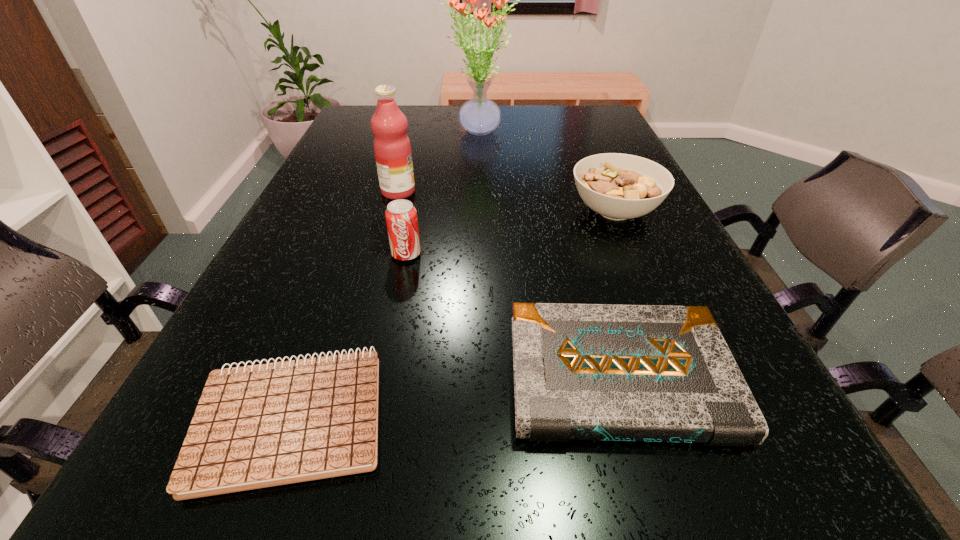
Where is `free space that is in between the fifth tallest object and the shortest object`? free space that is in between the fifth tallest object and the shortest object is located at coordinates (455, 397).

You are a GUI agent. You are given a task and a screenshot of the screen. Output one action in this format:
    pyautogui.click(x=<x>, y=<y>)
    Task: Click on the vacant space in between the farthest object and the fourth farthest object
    The height and width of the screenshot is (540, 960).
    Given the screenshot: What is the action you would take?
    pyautogui.click(x=443, y=193)

Where is `free space between the farthest object and the fourth tallest object`? free space between the farthest object and the fourth tallest object is located at coordinates (546, 172).

This screenshot has height=540, width=960. In order to click on free space between the fifth tallest object and the farthest object in this screenshot , I will do `click(548, 255)`.

Where is `vacant area that lies between the shortest object and the right notebook`? The width and height of the screenshot is (960, 540). vacant area that lies between the shortest object and the right notebook is located at coordinates (455, 397).

Where is `blank region between the fifth tallest object and the fruit juice`? blank region between the fifth tallest object and the fruit juice is located at coordinates (509, 285).

At what (x,y) coordinates should I click in order to perform the action: click on vacant region between the shortest object and the flower arrangement. Please return your answer as a coordinate pair (x, y). This screenshot has width=960, height=540. Looking at the image, I should click on (385, 275).

The width and height of the screenshot is (960, 540). In order to click on vacant area between the third shortest object and the farthest object in this screenshot , I will do `click(546, 172)`.

Identify which object is located as the fourth nearest to the second shortest object. Please provide its 2D coordinates. Your answer should be formatted as a tuple, i.e. [(x, y)], where the tuple contains the x and y coordinates of a point satisfying the conditions above.

[(392, 148)]

Identify which object is the second closest to the shortest object. Please provide its 2D coordinates. Your answer should be formatted as a tuple, i.e. [(x, y)], where the tuple contains the x and y coordinates of a point satisfying the conditions above.

[(401, 216)]